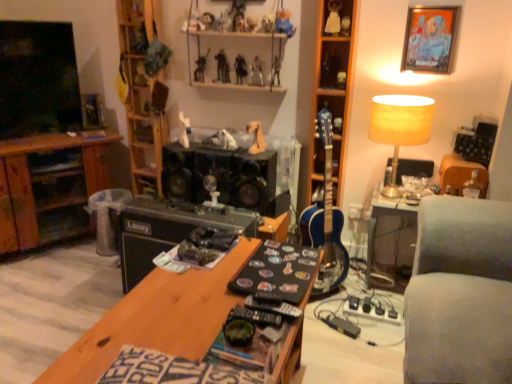
I want to click on free space to the left of orange matte horse at center, arranged as the 9th toy when viewed from the left, so click(x=226, y=149).